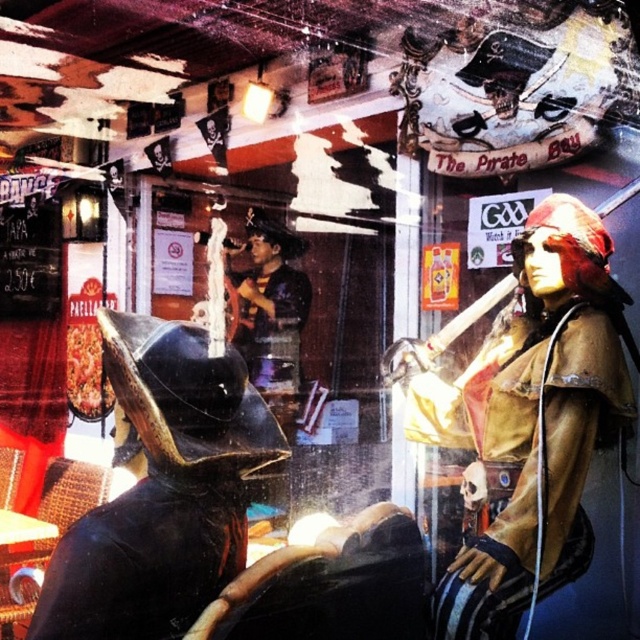
Question: Which point is closer to the camera?

Choices:
 (A) gold metallic pirate at center
 (B) shiny black helmet at left

Answer: (B)

Question: In this image, where is gold metallic pirate at center located relative to shiny black helmet at left?

Choices:
 (A) below
 (B) above

Answer: (B)

Question: Does gold metallic pirate at center appear on the right side of shiny black helmet at left?

Choices:
 (A) no
 (B) yes

Answer: (B)

Question: Which point is closer to the camera taking this photo?

Choices:
 (A) (573, 355)
 (B) (236, 504)

Answer: (B)

Question: Is gold metallic pirate at center wider than shiny black helmet at left?

Choices:
 (A) yes
 (B) no

Answer: (A)